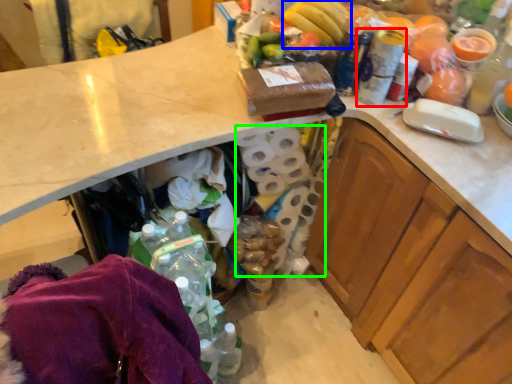
Question: Which object is the farthest from bottle (highlighted by a red box)? Choose among these: banana (highlighted by a blue box) or toilet paper (highlighted by a green box).

Choices:
 (A) banana
 (B) toilet paper

Answer: (B)